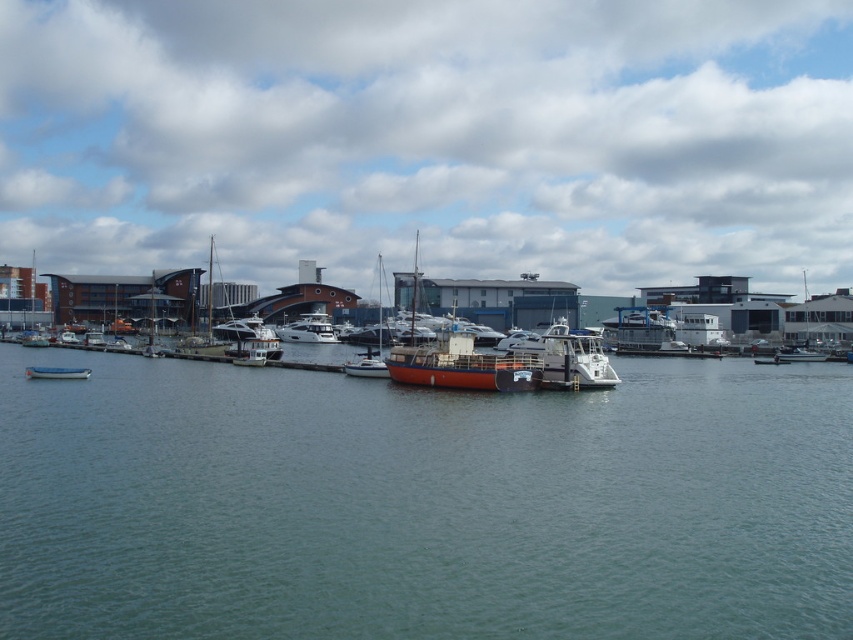
Can you confirm if greenish-blue water at center is shorter than metallic silver boat at lower left?

Incorrect, greenish-blue water at center's height does not fall short of metallic silver boat at lower left's.

In the scene shown: Is greenish-blue water at center to the left of metallic silver boat at lower left from the viewer's perspective?

No, greenish-blue water at center is not to the left of metallic silver boat at lower left.

Measure the distance between point (364, 532) and camera.

A distance of 12.48 meters exists between point (364, 532) and camera.

Find the location of a particular element. This screenshot has height=640, width=853. greenish-blue water at center is located at coordinates (422, 502).

Can you confirm if white glossy yacht at center is thinner than metallic silver boat at lower left?

Incorrect, white glossy yacht at center's width is not less than metallic silver boat at lower left's.

Which is more to the left, white glossy yacht at center or metallic silver boat at lower left?

Positioned to the left is metallic silver boat at lower left.

Does point (305, 316) come closer to viewer compared to point (54, 371)?

That is False.

You are a GUI agent. You are given a task and a screenshot of the screen. Output one action in this format:
    pyautogui.click(x=<x>, y=<y>)
    Task: Click on the white glossy yacht at center
    The height and width of the screenshot is (640, 853).
    Given the screenshot: What is the action you would take?
    pyautogui.click(x=308, y=330)

Which is above, white glossy yacht at center or white glossy boat at center?

white glossy yacht at center is above.

Can you confirm if white glossy yacht at center is smaller than white glossy boat at center?

Actually, white glossy yacht at center might be larger than white glossy boat at center.

Is point (306, 340) farther from camera compared to point (791, 356)?

Yes, it is behind point (791, 356).

Locate an element on the screen. white glossy yacht at center is located at coordinates (308, 330).